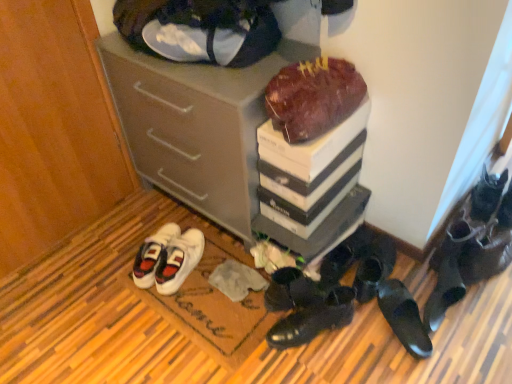
Where is `vacant region to the left of black leather shoes at lower right, which is the seventh footwear in right-to-left order`? Image resolution: width=512 pixels, height=384 pixels. vacant region to the left of black leather shoes at lower right, which is the seventh footwear in right-to-left order is located at coordinates (239, 325).